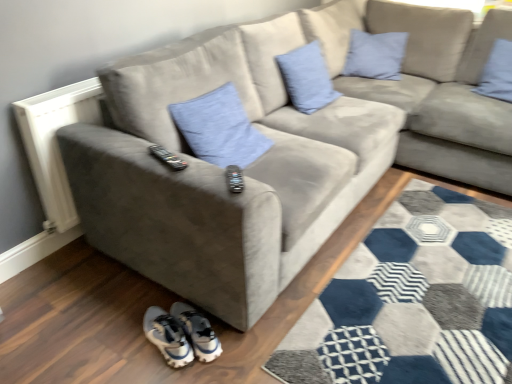
Question: Could you tell me if blue fabric pillow at upper right, the 4th pillow when ordered from left to right, is turned towards blue fabric pillow at center, the 1th pillow from the left?

Choices:
 (A) yes
 (B) no

Answer: (B)

Question: From the image's perspective, is blue fabric pillow at upper right, the 4th pillow when ordered from left to right, above blue fabric pillow at center, positioned as the fourth pillow in right-to-left order?

Choices:
 (A) no
 (B) yes

Answer: (B)

Question: Is the surface of blue fabric pillow at upper right, the 4th pillow when ordered from left to right, in direct contact with blue fabric pillow at center, positioned as the fourth pillow in right-to-left order?

Choices:
 (A) no
 (B) yes

Answer: (A)

Question: From a real-world perspective, is blue fabric pillow at upper right, the 4th pillow when ordered from left to right, on blue fabric pillow at center, the 1th pillow from the left?

Choices:
 (A) yes
 (B) no

Answer: (A)

Question: Considering the relative sizes of blue fabric pillow at upper right, which is counted as the first pillow, starting from the right, and blue fabric pillow at center, the 1th pillow from the left, in the image provided, is blue fabric pillow at upper right, which is counted as the first pillow, starting from the right, taller than blue fabric pillow at center, the 1th pillow from the left,?

Choices:
 (A) no
 (B) yes

Answer: (B)

Question: Is blue fabric pillow at upper right, the 4th pillow when ordered from left to right, far away from blue fabric pillow at center, the 1th pillow from the left?

Choices:
 (A) no
 (B) yes

Answer: (B)

Question: Is blue fabric pillow at center, positioned as the fourth pillow in right-to-left order, not near blue linen pillow at upper center, which ranks as the second pillow in left-to-right order?

Choices:
 (A) yes
 (B) no

Answer: (B)

Question: Is blue fabric pillow at center, the 1th pillow from the left, oriented towards blue linen pillow at upper center, placed as the 3th pillow when sorted from right to left?

Choices:
 (A) no
 (B) yes

Answer: (A)

Question: From a real-world perspective, is blue fabric pillow at center, the 1th pillow from the left, physically above blue linen pillow at upper center, which ranks as the second pillow in left-to-right order?

Choices:
 (A) no
 (B) yes

Answer: (A)

Question: Is blue fabric pillow at center, positioned as the fourth pillow in right-to-left order, closer to camera compared to blue linen pillow at upper center, which ranks as the second pillow in left-to-right order?

Choices:
 (A) no
 (B) yes

Answer: (B)

Question: Considering the relative sizes of blue fabric pillow at center, positioned as the fourth pillow in right-to-left order, and blue linen pillow at upper center, which ranks as the second pillow in left-to-right order, in the image provided, is blue fabric pillow at center, positioned as the fourth pillow in right-to-left order, bigger than blue linen pillow at upper center, which ranks as the second pillow in left-to-right order,?

Choices:
 (A) no
 (B) yes

Answer: (B)

Question: From the image's perspective, does blue fabric pillow at center, the 1th pillow from the left, appear lower than blue linen pillow at upper center, which ranks as the second pillow in left-to-right order?

Choices:
 (A) no
 (B) yes

Answer: (B)

Question: Is white synthetic sneakers at lower center positioned far away from white textured radiator at left?

Choices:
 (A) yes
 (B) no

Answer: (B)